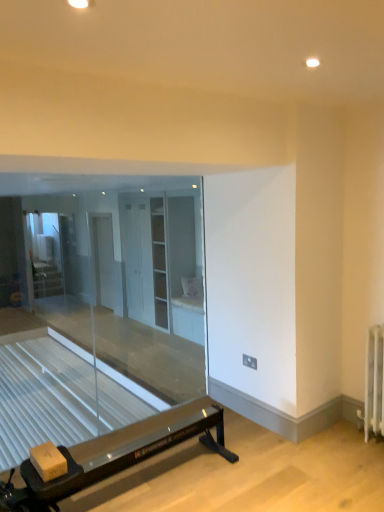
Question: Considering the relative sizes of white glossy screen door at center, placed as the 1th screen door when sorted from left to right, and transparent glass door at left in the image provided, is white glossy screen door at center, placed as the 1th screen door when sorted from left to right, taller than transparent glass door at left?

Choices:
 (A) yes
 (B) no

Answer: (A)

Question: From a real-world perspective, does white glossy screen door at center, the 2th screen door positioned from the front, stand above transparent glass door at left?

Choices:
 (A) yes
 (B) no

Answer: (B)

Question: Does white glossy screen door at center, the 2th screen door positioned from the front, have a lesser height compared to transparent glass door at left?

Choices:
 (A) yes
 (B) no

Answer: (B)

Question: Is white glossy screen door at center, the 2th screen door positioned from the front, positioned far away from transparent glass door at left?

Choices:
 (A) no
 (B) yes

Answer: (A)

Question: Is white glossy screen door at center, the 1th screen door in the back-to-front sequence, at the right side of transparent glass door at left?

Choices:
 (A) no
 (B) yes

Answer: (B)

Question: From a real-world perspective, is white glossy screen door at center, placed as the 1th screen door when sorted from left to right, positioned above or below white glossy cabinet at center, positioned as the 2th screen door in back-to-front order?

Choices:
 (A) above
 (B) below

Answer: (B)

Question: From the image's perspective, is white glossy screen door at center, the second screen door in the right-to-left sequence, positioned above or below white glossy cabinet at center, placed as the first screen door when sorted from right to left?

Choices:
 (A) above
 (B) below

Answer: (B)

Question: Considering the positions of white glossy screen door at center, the second screen door in the right-to-left sequence, and white glossy cabinet at center, positioned as the 2th screen door in back-to-front order, in the image, is white glossy screen door at center, the second screen door in the right-to-left sequence, bigger or smaller than white glossy cabinet at center, positioned as the 2th screen door in back-to-front order,?

Choices:
 (A) small
 (B) big

Answer: (A)

Question: From their relative heights in the image, would you say white glossy screen door at center, the second screen door in the right-to-left sequence, is taller or shorter than white glossy cabinet at center, positioned as the 2th screen door in back-to-front order?

Choices:
 (A) short
 (B) tall

Answer: (A)

Question: Considering the positions of transparent glass door at left and white glossy screen door at center, the 2th screen door positioned from the front, in the image, is transparent glass door at left taller or shorter than white glossy screen door at center, the 2th screen door positioned from the front,?

Choices:
 (A) tall
 (B) short

Answer: (B)

Question: Is transparent glass door at left wider or thinner than white glossy screen door at center, placed as the 1th screen door when sorted from left to right?

Choices:
 (A) thin
 (B) wide

Answer: (A)

Question: Which is correct: transparent glass door at left is inside white glossy screen door at center, the 2th screen door positioned from the front, or outside of it?

Choices:
 (A) outside
 (B) inside

Answer: (A)

Question: From the image's perspective, is transparent glass door at left above or below white glossy screen door at center, the 2th screen door positioned from the front?

Choices:
 (A) above
 (B) below

Answer: (A)

Question: Based on their positions, is transparent glass door at left located to the left or right of white glossy cabinet at center, which is the 2th screen door in left-to-right order?

Choices:
 (A) left
 (B) right

Answer: (A)

Question: Looking at the image, does transparent glass door at left seem bigger or smaller compared to white glossy cabinet at center, placed as the first screen door when sorted from right to left?

Choices:
 (A) small
 (B) big

Answer: (A)